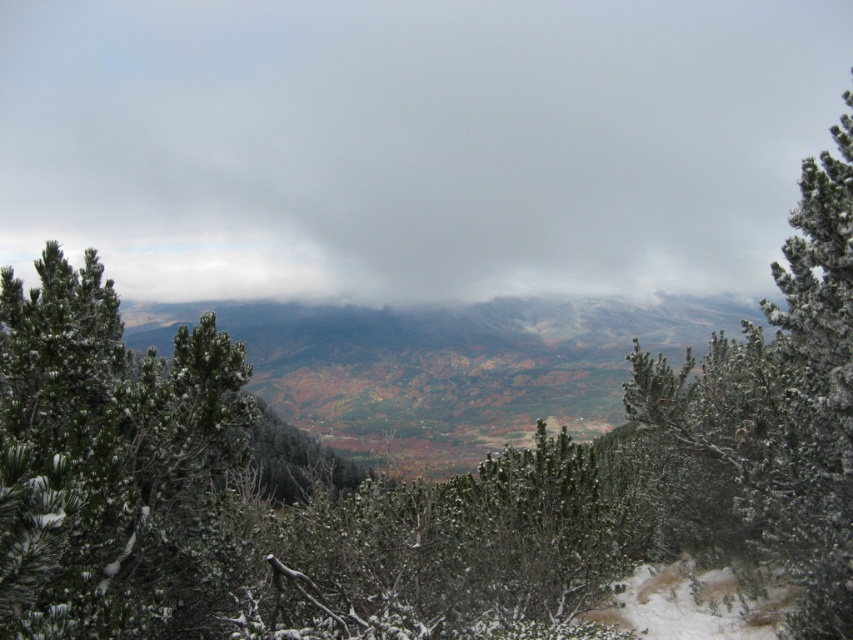
Can you confirm if white fluffy cloud at upper center is bigger than green matte tree at center?

Correct, white fluffy cloud at upper center is larger in size than green matte tree at center.

Locate an element on the screen. white fluffy cloud at upper center is located at coordinates (415, 141).

Identify the location of white fluffy cloud at upper center. (415, 141).

Can you confirm if green matte tree at center is positioned below white frosty pine at upper right?

Actually, green matte tree at center is above white frosty pine at upper right.

Can you confirm if green matte tree at center is positioned above white frosty pine at upper right?

Yes.

Is point (250, 369) positioned behind point (846, 420)?

No, (250, 369) is in front of (846, 420).

This screenshot has height=640, width=853. Find the location of `green matte tree at center`. green matte tree at center is located at coordinates (109, 461).

Is point (335, 145) positioned in front of point (782, 330)?

That is False.

Does point (784, 28) come farther from viewer compared to point (827, 413)?

Yes, point (784, 28) is farther from viewer.

Where is `white fluffy cloud at upper center`? This screenshot has width=853, height=640. white fluffy cloud at upper center is located at coordinates (415, 141).